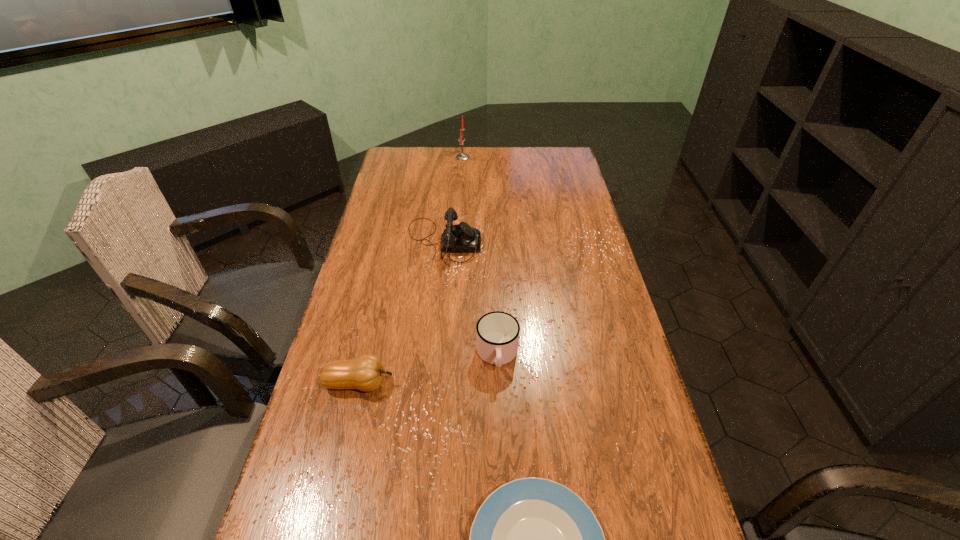
You are a GUI agent. You are given a task and a screenshot of the screen. Output one action in this format:
    pyautogui.click(x=<x>, y=<y>)
    Task: Click on the candle
    Image resolution: width=960 pixels, height=540 pixels.
    Given the screenshot: What is the action you would take?
    pyautogui.click(x=462, y=156)

What are the coordinates of `the tallest object` in the screenshot? It's located at (462, 156).

This screenshot has height=540, width=960. I want to click on the fourth nearest object, so 461,238.

This screenshot has height=540, width=960. I want to click on mug, so click(x=497, y=332).

Where is `gourd`? The width and height of the screenshot is (960, 540). gourd is located at coordinates (366, 373).

Find the location of `vacant point located on the front-facing side of the candle`. vacant point located on the front-facing side of the candle is located at coordinates (499, 157).

Locate an element on the screen. The width and height of the screenshot is (960, 540). vacant space located on the front-facing side of the telephone is located at coordinates (495, 242).

Identify the location of free region located on the side of the mug with the handle. (500, 438).

Locate an element on the screen. This screenshot has height=540, width=960. blank space located on the stem side of the gourd is located at coordinates (497, 383).

The height and width of the screenshot is (540, 960). Identify the location of object that is at the far edge. (462, 156).